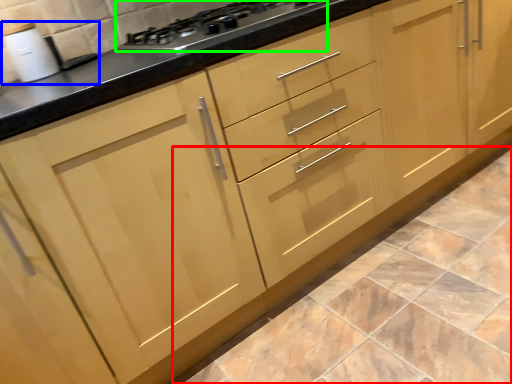
Question: Estimate the real-world distances between objects in this image. Which object is farther from ceramic tile (highlighted by a red box), sink (highlighted by a blue box) or gas stove (highlighted by a green box)?

Choices:
 (A) sink
 (B) gas stove

Answer: (A)